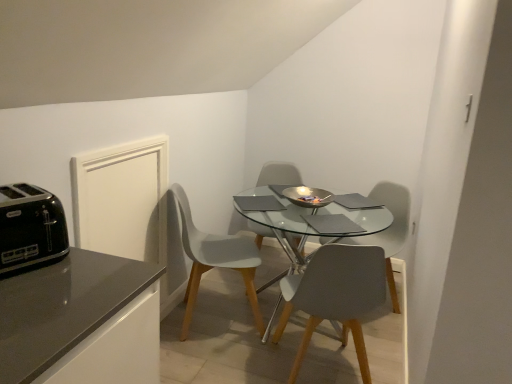
Describe the element at coordinates (337, 295) in the screenshot. I see `matte gray chair at center, placed as the third chair when sorted from left to right` at that location.

What do you see at coordinates (279, 175) in the screenshot?
I see `matte gray chair at center, positioned as the 2th chair in left-to-right order` at bounding box center [279, 175].

The height and width of the screenshot is (384, 512). What do you see at coordinates (308, 219) in the screenshot?
I see `transparent glass table at center` at bounding box center [308, 219].

What is the approximate width of matte gray chair at center, which is counted as the first chair, starting from the right?

52.90 centimeters.

Where is `white matte chair at center, positioned as the fourth chair in right-to-left order`? white matte chair at center, positioned as the fourth chair in right-to-left order is located at coordinates (215, 260).

In the scene shown: Which is more to the left, matte gray chair at center, which is counted as the 4th chair, starting from the left, or matte gray chair at center, placed as the third chair when sorted from left to right?

matte gray chair at center, placed as the third chair when sorted from left to right, is more to the left.

Does matte gray chair at center, which is counted as the 4th chair, starting from the left, have a lesser height compared to matte gray chair at center, the 2th chair when ordered from right to left?

No, matte gray chair at center, which is counted as the 4th chair, starting from the left, is not shorter than matte gray chair at center, the 2th chair when ordered from right to left.

How different are the orientations of matte gray chair at center, which is counted as the first chair, starting from the right, and matte gray chair at center, placed as the third chair when sorted from left to right, in degrees?

The facing directions of matte gray chair at center, which is counted as the first chair, starting from the right, and matte gray chair at center, placed as the third chair when sorted from left to right, are 120 degrees apart.

From a real-world perspective, is matte gray chair at center, which is counted as the first chair, starting from the right, on matte gray chair at center, placed as the third chair when sorted from left to right?

Yes.

Considering the sizes of objects matte gray chair at center, which is counted as the 4th chair, starting from the left, and matte gray chair at center, marked as the third chair in a right-to-left arrangement, in the image provided, who is shorter, matte gray chair at center, which is counted as the 4th chair, starting from the left, or matte gray chair at center, marked as the third chair in a right-to-left arrangement,?

matte gray chair at center, which is counted as the 4th chair, starting from the left.

Which of these two, matte gray chair at center, which is counted as the first chair, starting from the right, or matte gray chair at center, marked as the third chair in a right-to-left arrangement, is smaller?

Smaller between the two is matte gray chair at center, which is counted as the first chair, starting from the right.

From a real-world perspective, is matte gray chair at center, which is counted as the 4th chair, starting from the left, located beneath matte gray chair at center, positioned as the 2th chair in left-to-right order?

Correct, in the physical world, matte gray chair at center, which is counted as the 4th chair, starting from the left, is lower than matte gray chair at center, positioned as the 2th chair in left-to-right order.

Which of these two, matte gray chair at center, which is counted as the first chair, starting from the right, or matte gray chair at center, positioned as the 2th chair in left-to-right order, is thinner?

matte gray chair at center, which is counted as the first chair, starting from the right.

Is point (333, 269) closer or farther from the camera than point (19, 240)?

Clearly, point (333, 269) is more distant from the camera than point (19, 240).

In the image, is matte gray chair at center, placed as the third chair when sorted from left to right, positioned in front of or behind black plastic toaster at left?

Clearly, matte gray chair at center, placed as the third chair when sorted from left to right, is behind black plastic toaster at left.

From the image's perspective, which one is positioned higher, matte gray chair at center, the 2th chair when ordered from right to left, or black plastic toaster at left?

From the image's view, black plastic toaster at left is above.

Are matte gray chair at center, positioned as the 2th chair in left-to-right order, and matte gray chair at center, which is counted as the first chair, starting from the right, beside each other?

No, matte gray chair at center, positioned as the 2th chair in left-to-right order, is not making contact with matte gray chair at center, which is counted as the first chair, starting from the right.

From the image's perspective, is matte gray chair at center, marked as the third chair in a right-to-left arrangement, above matte gray chair at center, which is counted as the 4th chair, starting from the left?

Yes, from the image's perspective, matte gray chair at center, marked as the third chair in a right-to-left arrangement, is on top of matte gray chair at center, which is counted as the 4th chair, starting from the left.

Does matte gray chair at center, marked as the third chair in a right-to-left arrangement, appear on the right side of matte gray chair at center, which is counted as the first chair, starting from the right?

No, matte gray chair at center, marked as the third chair in a right-to-left arrangement, is not to the right of matte gray chair at center, which is counted as the first chair, starting from the right.

How many degrees apart are the facing directions of black plastic toaster at left and white matte chair at center, positioned as the fourth chair in right-to-left order?

There is a 42.7-degree angle between the facing directions of black plastic toaster at left and white matte chair at center, positioned as the fourth chair in right-to-left order.

At what (x,y) coordinates should I click in order to perform the action: click on toaster in front of the white matte chair at center, positioned as the fourth chair in right-to-left order. Please return your answer as a coordinate pair (x, y). Looking at the image, I should click on (30, 227).

Can you confirm if black plastic toaster at left is wider than white matte chair at center, the first chair from the left?

No, black plastic toaster at left is not wider than white matte chair at center, the first chair from the left.

Is black plastic toaster at left aimed at white matte chair at center, the first chair from the left?

No, black plastic toaster at left is not facing towards white matte chair at center, the first chair from the left.

Locate an element on the screen. Image resolution: width=512 pixels, height=384 pixels. the 3rd chair behind when counting from the transparent glass table at center is located at coordinates (279, 175).

Considering the sizes of objects transparent glass table at center and matte gray chair at center, marked as the third chair in a right-to-left arrangement, in the image provided, who is taller, transparent glass table at center or matte gray chair at center, marked as the third chair in a right-to-left arrangement,?

With more height is matte gray chair at center, marked as the third chair in a right-to-left arrangement.

From the image's perspective, does transparent glass table at center appear higher than matte gray chair at center, positioned as the 2th chair in left-to-right order?

Actually, transparent glass table at center appears below matte gray chair at center, positioned as the 2th chair in left-to-right order, in the image.

From the picture: Is transparent glass table at center wider or thinner than matte gray chair at center, marked as the third chair in a right-to-left arrangement?

In the image, transparent glass table at center appears to be wider than matte gray chair at center, marked as the third chair in a right-to-left arrangement.

Could you tell me if black plastic toaster at left is turned towards matte gray chair at center, the 2th chair when ordered from right to left?

No, black plastic toaster at left does not turn towards matte gray chair at center, the 2th chair when ordered from right to left.

From the image's perspective, between black plastic toaster at left and matte gray chair at center, the 2th chair when ordered from right to left, which one is located above?

black plastic toaster at left, from the image's perspective.

Between black plastic toaster at left and matte gray chair at center, the 2th chair when ordered from right to left, which one appears on the left side from the viewer's perspective?

black plastic toaster at left.

Measure the distance between black plastic toaster at left and matte gray chair at center, the 2th chair when ordered from right to left.

black plastic toaster at left and matte gray chair at center, the 2th chair when ordered from right to left, are 3.59 feet apart.

Find the location of `the 2nd chair below the matte gray chair at center, which is counted as the first chair, starting from the right (from the image's perspective)`. the 2nd chair below the matte gray chair at center, which is counted as the first chair, starting from the right (from the image's perspective) is located at coordinates click(337, 295).

At what (x,y) coordinates should I click in order to perform the action: click on chair behind the matte gray chair at center, which is counted as the first chair, starting from the right. Please return your answer as a coordinate pair (x, y). This screenshot has height=384, width=512. Looking at the image, I should click on (279, 175).

Which object lies further to the anchor point transparent glass table at center, matte gray chair at center, placed as the third chair when sorted from left to right, or matte gray chair at center, positioned as the 2th chair in left-to-right order?

matte gray chair at center, positioned as the 2th chair in left-to-right order, is positioned further to the anchor transparent glass table at center.

Estimate the real-world distances between objects in this image. Which object is further from white matte chair at center, positioned as the fourth chair in right-to-left order, black plastic toaster at left or matte gray chair at center, which is counted as the first chair, starting from the right?

Based on the image, black plastic toaster at left appears to be further to white matte chair at center, positioned as the fourth chair in right-to-left order.

Based on the photo, estimate the real-world distances between objects in this image. Which object is closer to transparent glass table at center, white matte chair at center, positioned as the fourth chair in right-to-left order, or matte gray chair at center, which is counted as the first chair, starting from the right?

The object closer to transparent glass table at center is white matte chair at center, positioned as the fourth chair in right-to-left order.

Looking at this image, when comparing their distances from black plastic toaster at left, does transparent glass table at center or matte gray chair at center, which is counted as the first chair, starting from the right, seem further?

Among the two, matte gray chair at center, which is counted as the first chair, starting from the right, is located further to black plastic toaster at left.

From the image, which object appears to be nearer to black plastic toaster at left, transparent glass table at center or white matte chair at center, the first chair from the left?

Among the two, white matte chair at center, the first chair from the left, is located nearer to black plastic toaster at left.

Considering their positions, is transparent glass table at center positioned closer to white matte chair at center, the first chair from the left, than matte gray chair at center, positioned as the 2th chair in left-to-right order?

transparent glass table at center lies closer to white matte chair at center, the first chair from the left, than the other object.

Considering their positions, is matte gray chair at center, the 2th chair when ordered from right to left, positioned closer to black plastic toaster at left than matte gray chair at center, marked as the third chair in a right-to-left arrangement?

matte gray chair at center, the 2th chair when ordered from right to left, is positioned closer to the anchor black plastic toaster at left.

Based on the photo, when comparing their distances from black plastic toaster at left, does matte gray chair at center, marked as the third chair in a right-to-left arrangement, or matte gray chair at center, which is counted as the first chair, starting from the right, seem further?

Among the two, matte gray chair at center, marked as the third chair in a right-to-left arrangement, is located further to black plastic toaster at left.

Where is `kitchen & dining room table between white matte chair at center, positioned as the fourth chair in right-to-left order, and matte gray chair at center, which is counted as the 4th chair, starting from the left, in the horizontal direction`? kitchen & dining room table between white matte chair at center, positioned as the fourth chair in right-to-left order, and matte gray chair at center, which is counted as the 4th chair, starting from the left, in the horizontal direction is located at coordinates (308, 219).

Identify the location of chair positioned between black plastic toaster at left and white matte chair at center, the first chair from the left, from near to far. This screenshot has width=512, height=384. (337, 295).

Identify the location of kitchen & dining room table positioned between black plastic toaster at left and matte gray chair at center, positioned as the 2th chair in left-to-right order, from near to far. The height and width of the screenshot is (384, 512). (308, 219).

Where is `kitchen & dining room table situated between black plastic toaster at left and matte gray chair at center, the 2th chair when ordered from right to left, from left to right`? kitchen & dining room table situated between black plastic toaster at left and matte gray chair at center, the 2th chair when ordered from right to left, from left to right is located at coordinates [308, 219].